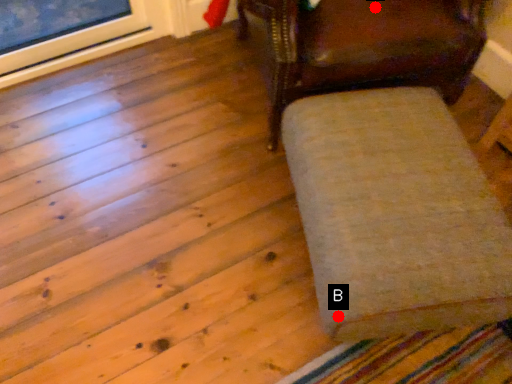
Question: Two points are circled on the image, labeled by A and B beside each circle. Which point is closer to the camera?

Choices:
 (A) A is closer
 (B) B is closer

Answer: (B)